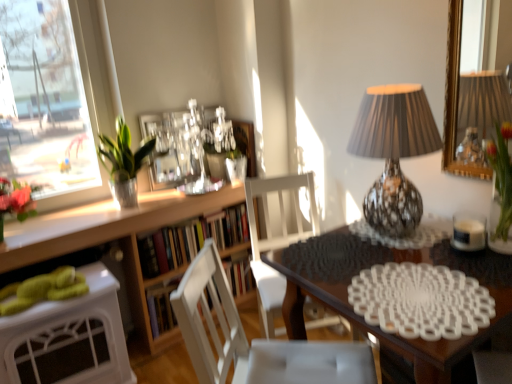
Question: Considering the relative sizes of clear glass picture frame at upper center and white glossy desk at lower left in the image provided, is clear glass picture frame at upper center taller than white glossy desk at lower left?

Choices:
 (A) no
 (B) yes

Answer: (A)

Question: Considering the relative positions of clear glass picture frame at upper center and white glossy desk at lower left in the image provided, is clear glass picture frame at upper center to the left of white glossy desk at lower left from the viewer's perspective?

Choices:
 (A) yes
 (B) no

Answer: (B)

Question: Considering the relative sizes of clear glass picture frame at upper center and white glossy desk at lower left in the image provided, is clear glass picture frame at upper center smaller than white glossy desk at lower left?

Choices:
 (A) no
 (B) yes

Answer: (B)

Question: From a real-world perspective, is clear glass picture frame at upper center on white glossy desk at lower left?

Choices:
 (A) yes
 (B) no

Answer: (A)

Question: Is clear glass picture frame at upper center oriented away from white glossy desk at lower left?

Choices:
 (A) yes
 (B) no

Answer: (B)

Question: Considering the positions of shiny metallic lamp at upper right and white matte chair at center, arranged as the 1th chair when viewed from the back, in the image, is shiny metallic lamp at upper right taller or shorter than white matte chair at center, arranged as the 1th chair when viewed from the back,?

Choices:
 (A) short
 (B) tall

Answer: (A)

Question: Is shiny metallic lamp at upper right spatially inside white matte chair at center, the 2th chair in the front-to-back sequence, or outside of it?

Choices:
 (A) outside
 (B) inside

Answer: (A)

Question: Is shiny metallic lamp at upper right wider or thinner than white matte chair at center, arranged as the 1th chair when viewed from the back?

Choices:
 (A) thin
 (B) wide

Answer: (A)

Question: Is point (406, 105) positioned closer to the camera than point (254, 226)?

Choices:
 (A) closer
 (B) farther

Answer: (A)

Question: Is point pyautogui.click(x=118, y=327) positioned closer to the camera than point pyautogui.click(x=508, y=200)?

Choices:
 (A) farther
 (B) closer

Answer: (A)

Question: Is white glossy desk at lower left situated inside green glass vase at upper right or outside?

Choices:
 (A) outside
 (B) inside

Answer: (A)

Question: Is white glossy desk at lower left to the left or to the right of green glass vase at upper right in the image?

Choices:
 (A) right
 (B) left

Answer: (B)

Question: In terms of width, does white glossy desk at lower left look wider or thinner when compared to green glass vase at upper right?

Choices:
 (A) wide
 (B) thin

Answer: (A)

Question: Considering their positions, is white glass candle at right located in front of or behind wooden bookshelf at center?

Choices:
 (A) behind
 (B) front

Answer: (B)

Question: Considering the relative positions of white glass candle at right and wooden bookshelf at center in the image provided, is white glass candle at right to the left or to the right of wooden bookshelf at center?

Choices:
 (A) right
 (B) left

Answer: (A)